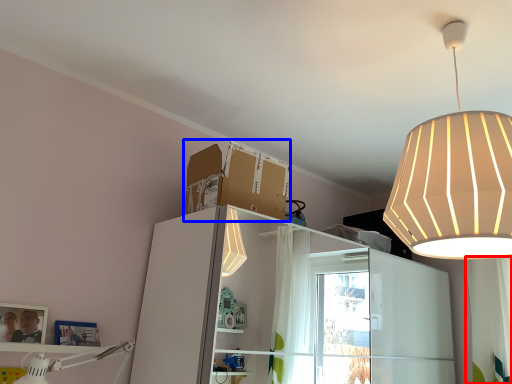
Question: Which point is closer to the camera, curtain (highlighted by a red box) or cardboard box (highlighted by a blue box)?

Choices:
 (A) curtain
 (B) cardboard box

Answer: (B)